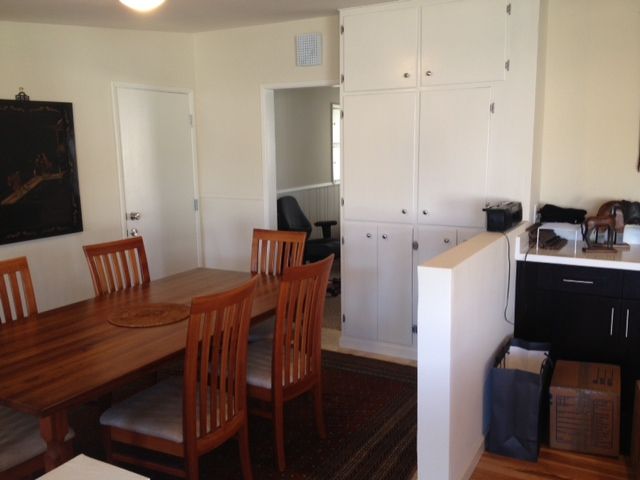
Locate an element on the screen. This screenshot has width=640, height=480. wooden dining chairs with tall backrest is located at coordinates (17, 306), (201, 400), (108, 260), (306, 303), (285, 235), (16, 449).